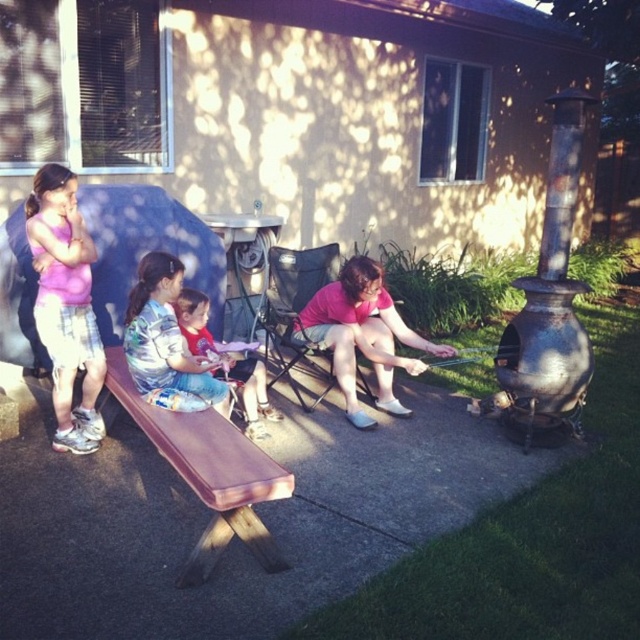
Question: Which object is positioned farthest from the brown wooden picnic table at center?

Choices:
 (A) matte pink shirt at left
 (B) red shirt at center
 (C) brown wood bench at left
 (D) pink matte shorts at center

Answer: (C)

Question: Can you confirm if pink matte shorts at center is wider than brown wooden picnic table at center?

Choices:
 (A) no
 (B) yes

Answer: (B)

Question: Which of the following is the farthest from the observer?

Choices:
 (A) (60, 202)
 (B) (228, 214)

Answer: (B)

Question: Estimate the real-world distances between objects in this image. Which object is farther from the brown wooden picnic table at center?

Choices:
 (A) red shirt at center
 (B) brown wood bench at left
 (C) pink matte shorts at center

Answer: (B)

Question: Does brown wood bench at left appear under red shirt at center?

Choices:
 (A) no
 (B) yes

Answer: (B)

Question: Does brown wood bench at left have a smaller size compared to blue denim shorts at center?

Choices:
 (A) no
 (B) yes

Answer: (A)